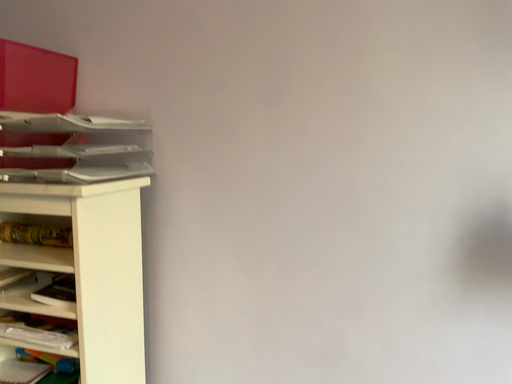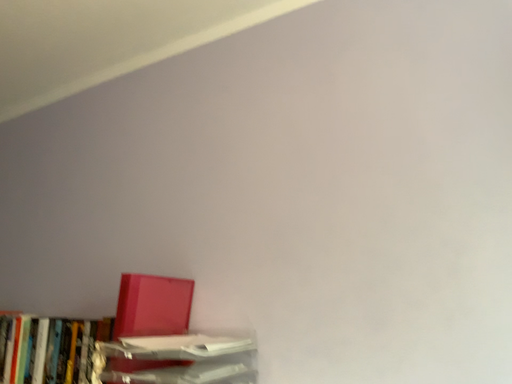
Question: How did the camera likely rotate when shooting the video?

Choices:
 (A) rotated upward
 (B) rotated downward

Answer: (A)